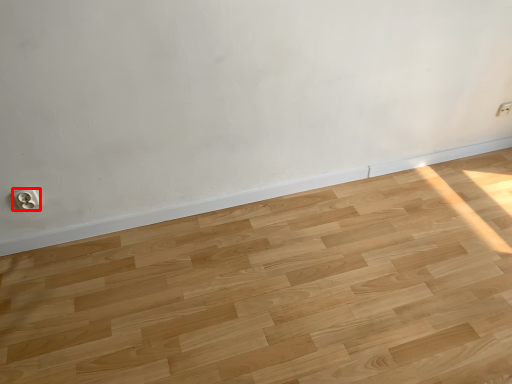
Question: From the image's perspective, where is electric outlet (annotated by the red box) located relative to electric outlet?

Choices:
 (A) above
 (B) below

Answer: (B)